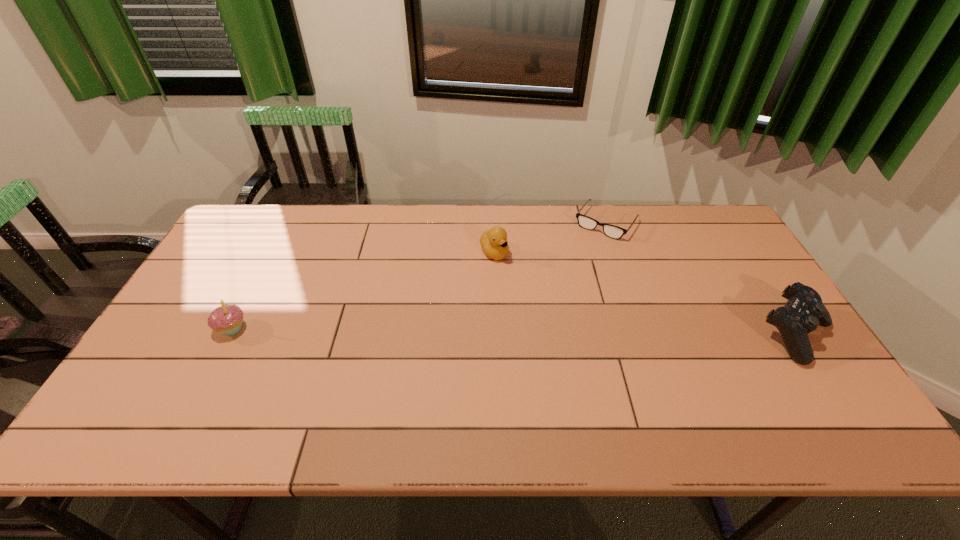
Where is `free space between the rightmost object and the leftmost object`? free space between the rightmost object and the leftmost object is located at coordinates pos(514,332).

The height and width of the screenshot is (540, 960). Find the location of `free area in between the leftmost object and the control`. free area in between the leftmost object and the control is located at coordinates (514, 332).

Identify the location of the second closest object relative to the cupcake. (612, 231).

The width and height of the screenshot is (960, 540). In order to click on object that is the third closest to the shortest object in this screenshot , I will do `click(227, 318)`.

Image resolution: width=960 pixels, height=540 pixels. I want to click on vacant space that satisfies the following two spatial constraints: 1. on the back side of the second object from left to right; 2. on the right side of the shortest object, so click(493, 222).

The image size is (960, 540). Find the location of `free location that satisfies the following two spatial constraints: 1. on the back side of the spectacles; 2. on the right side of the duckling`. free location that satisfies the following two spatial constraints: 1. on the back side of the spectacles; 2. on the right side of the duckling is located at coordinates (493, 222).

Locate an element on the screen. The image size is (960, 540). free region that satisfies the following two spatial constraints: 1. on the back side of the spectacles; 2. on the left side of the cupcake is located at coordinates (287, 222).